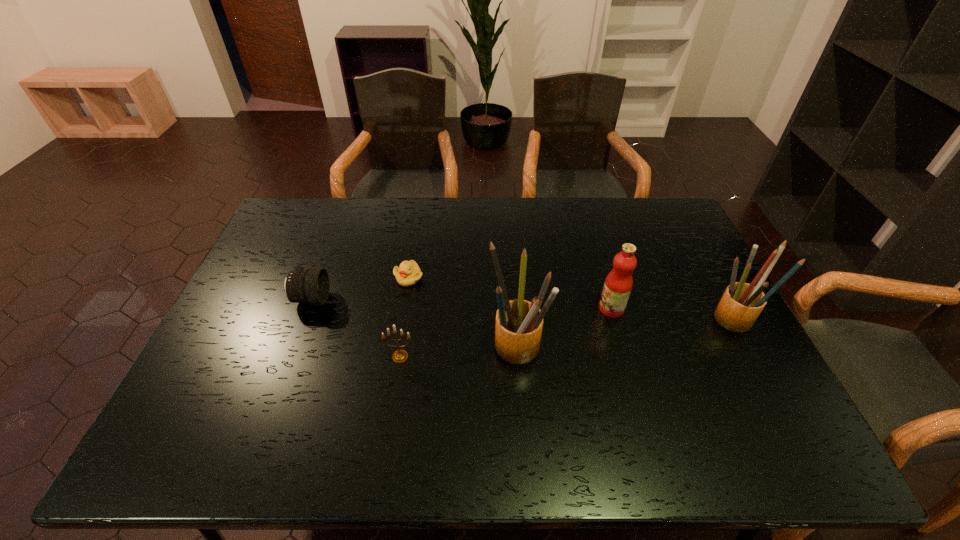
Please point out where to position a new pencil box on the left to maintain spacing. Please provide its 2D coordinates. Your answer should be formatted as a tuple, i.e. [(x, y)], where the tuple contains the x and y coordinates of a point satisfying the conditions above.

[(273, 375)]